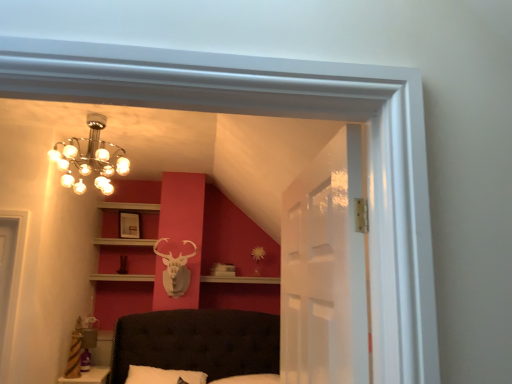
In order to click on vacant space in matte white picture frame at upper center (from a real-world perspective) in this screenshot , I will do `click(126, 234)`.